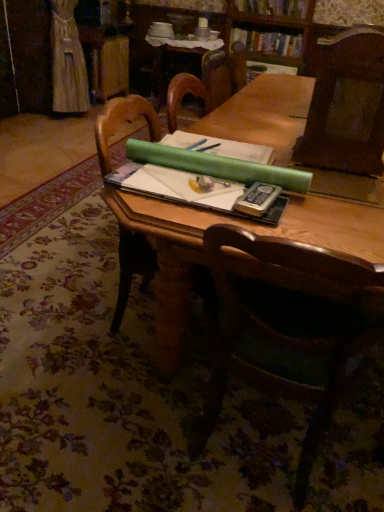
I want to click on hardcover book at upper center, positioned as the 2th book in bottom-to-top order, so click(274, 7).

This screenshot has height=512, width=384. I want to click on hardcover book at center, so click(x=257, y=199).

What do you see at coordinates (257, 199) in the screenshot? The width and height of the screenshot is (384, 512). I see `hardcover book at center` at bounding box center [257, 199].

What do you see at coordinates (346, 106) in the screenshot? I see `dark wood chair at upper right, the first chair when ordered from top to bottom` at bounding box center [346, 106].

Where is `green paper at upper center`? Image resolution: width=384 pixels, height=512 pixels. green paper at upper center is located at coordinates 177,60.

Is there a large distance between wooden bookcase at upper center and hardcover book at upper center, acting as the 1th book starting from the top?

No, wooden bookcase at upper center is in close proximity to hardcover book at upper center, acting as the 1th book starting from the top.

Considering the positions of points (247, 28) and (276, 15), is point (247, 28) closer to camera compared to point (276, 15)?

No.

Between wooden bookcase at upper center and hardcover book at upper center, positioned as the 2th book in bottom-to-top order, which one is positioned in front?

wooden bookcase at upper center is closer to the camera.

Is wooden table at center thinner than hardcover book at upper center, which is counted as the 2th book, starting from the top?

Incorrect, the width of wooden table at center is not less than that of hardcover book at upper center, which is counted as the 2th book, starting from the top.

From a real-world perspective, is wooden table at center below hardcover book at upper center, the 1th book when ordered from bottom to top?

Indeed, from a real-world perspective, wooden table at center is positioned beneath hardcover book at upper center, the 1th book when ordered from bottom to top.

Is wooden table at center taller or shorter than hardcover book at upper center, which is counted as the 2th book, starting from the top?

In the image, wooden table at center appears to be taller than hardcover book at upper center, which is counted as the 2th book, starting from the top.

Which is more to the right, wooden table at center or hardcover book at upper center, the 1th book when ordered from bottom to top?

hardcover book at upper center, the 1th book when ordered from bottom to top, is more to the right.

From a real-world perspective, is hardcover book at upper center, the 1th book when ordered from bottom to top, physically below dark wood chair at upper right, the first chair when ordered from top to bottom?

Yes, from a real-world perspective, hardcover book at upper center, the 1th book when ordered from bottom to top, is below dark wood chair at upper right, the first chair when ordered from top to bottom.

Would you say hardcover book at upper center, the 1th book when ordered from bottom to top, is a long distance from dark wood chair at upper right, acting as the 2th chair starting from the bottom?

Yes.

In the scene shown: Is hardcover book at upper center, which is counted as the 2th book, starting from the top, facing towards dark wood chair at upper right, acting as the 2th chair starting from the bottom?

Yes, hardcover book at upper center, which is counted as the 2th book, starting from the top, is facing dark wood chair at upper right, acting as the 2th chair starting from the bottom.

Can you confirm if dark wood chair at upper right, acting as the 2th chair starting from the bottom, is positioned to the left of green matte paper at center?

No.

Is dark wood chair at upper right, the first chair when ordered from top to bottom, positioned before green matte paper at center?

No, dark wood chair at upper right, the first chair when ordered from top to bottom, is behind green matte paper at center.

Is dark wood chair at upper right, the first chair when ordered from top to bottom, shorter than green matte paper at center?

Incorrect, the height of dark wood chair at upper right, the first chair when ordered from top to bottom, does not fall short of that of green matte paper at center.

From the image's perspective, which is above, hardcover book at upper center, acting as the 1th book starting from the top, or dark wood chair at upper right, the first chair when ordered from top to bottom?

hardcover book at upper center, acting as the 1th book starting from the top, from the image's perspective.

Could you tell me if hardcover book at upper center, acting as the 1th book starting from the top, is facing dark wood chair at upper right, acting as the 2th chair starting from the bottom?

Yes, hardcover book at upper center, acting as the 1th book starting from the top, is turned towards dark wood chair at upper right, acting as the 2th chair starting from the bottom.

From a real-world perspective, is hardcover book at upper center, positioned as the 2th book in bottom-to-top order, on dark wood chair at upper right, the first chair when ordered from top to bottom?

Correct, in the physical world, hardcover book at upper center, positioned as the 2th book in bottom-to-top order, is higher than dark wood chair at upper right, the first chair when ordered from top to bottom.

Is hardcover book at upper center, acting as the 1th book starting from the top, not within dark wood chair at upper right, acting as the 2th chair starting from the bottom?

Indeed, hardcover book at upper center, acting as the 1th book starting from the top, is completely outside dark wood chair at upper right, acting as the 2th chair starting from the bottom.

From a real-world perspective, is hardcover book at upper center, which is counted as the 2th book, starting from the top, positioned over wooden table at center based on gravity?

Yes.

Is hardcover book at upper center, which is counted as the 2th book, starting from the top, wider or thinner than wooden table at center?

Considering their sizes, hardcover book at upper center, which is counted as the 2th book, starting from the top, looks slimmer than wooden table at center.

Is hardcover book at upper center, which is counted as the 2th book, starting from the top, inside the boundaries of wooden table at center, or outside?

hardcover book at upper center, which is counted as the 2th book, starting from the top, is located beyond the bounds of wooden table at center.

Relative to wooden table at center, is hardcover book at upper center, the 1th book when ordered from bottom to top, in front or behind?

Clearly, hardcover book at upper center, the 1th book when ordered from bottom to top, is behind wooden table at center.

Which of these two, green paper at upper center or dark wood chair at upper right, the first chair when ordered from top to bottom, is wider?

With larger width is green paper at upper center.

Which object is closer to the camera taking this photo, green paper at upper center or dark wood chair at upper right, the first chair when ordered from top to bottom?

Positioned in front is dark wood chair at upper right, the first chair when ordered from top to bottom.

From a real-world perspective, who is located lower, green paper at upper center or dark wood chair at upper right, the first chair when ordered from top to bottom?

green paper at upper center, from a real-world perspective.

Locate an element on the screen. The image size is (384, 512). bookcase located underneath the hardcover book at upper center, acting as the 1th book starting from the top (from a real-world perspective) is located at coordinates (273, 29).

The height and width of the screenshot is (512, 384). There is a wooden table at center. In order to click on the 1st book above it (from the image's perspective) in this screenshot , I will do `click(268, 42)`.

Estimate the real-world distances between objects in this image. Which object is further from hardcover book at upper center, acting as the 1th book starting from the top, wooden table at center or wooden chair at center, which appears as the 1th chair when ordered from the bottom?

wooden chair at center, which appears as the 1th chair when ordered from the bottom, lies further to hardcover book at upper center, acting as the 1th book starting from the top, than the other object.

When comparing their distances from dark wood chair at upper right, acting as the 2th chair starting from the bottom, does wooden chair at center, which appears as the 1th chair when ordered from the bottom, or hardcover book at center seem further?

wooden chair at center, which appears as the 1th chair when ordered from the bottom, is further to dark wood chair at upper right, acting as the 2th chair starting from the bottom.

From the image, which object appears to be farther from wooden bookcase at upper center, green matte paper at center or dark wood chair at upper right, the first chair when ordered from top to bottom?

green matte paper at center lies further to wooden bookcase at upper center than the other object.

When comparing their distances from green paper at upper center, does hardcover book at center or wooden table at center seem further?

hardcover book at center lies further to green paper at upper center than the other object.

Based on their spatial positions, is wooden bookcase at upper center or green paper at upper center closer to hardcover book at upper center, positioned as the 2th book in bottom-to-top order?

wooden bookcase at upper center is positioned closer to the anchor hardcover book at upper center, positioned as the 2th book in bottom-to-top order.

From the image, which object appears to be nearer to wooden table at center, green paper at upper center or wooden bookcase at upper center?

wooden bookcase at upper center lies closer to wooden table at center than the other object.

Looking at the image, which one is located further to wooden chair at center, arranged as the 2th chair when viewed from the top, green matte paper at center or wooden table at center?

wooden table at center is further to wooden chair at center, arranged as the 2th chair when viewed from the top.

From the image, which object appears to be nearer to wooden chair at center, arranged as the 2th chair when viewed from the top, hardcover book at center or hardcover book at upper center, positioned as the 2th book in bottom-to-top order?

hardcover book at center.

The width and height of the screenshot is (384, 512). I want to click on side table between hardcover book at center and hardcover book at upper center, which is counted as the 2th book, starting from the top, from front to back, so click(x=177, y=60).

I want to click on table between green matte paper at center and green paper at upper center from front to back, so click(243, 227).

Identify the location of table located between green matte paper at center and hardcover book at upper center, positioned as the 2th book in bottom-to-top order, in the depth direction. This screenshot has height=512, width=384. (243, 227).

I want to click on chair positioned between green matte paper at center and hardcover book at upper center, positioned as the 2th book in bottom-to-top order, from near to far, so click(x=346, y=106).